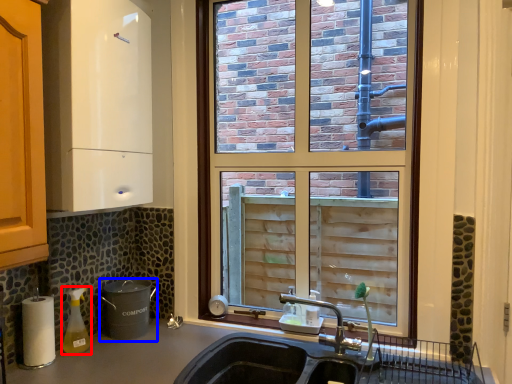
Question: Which of the following is the farthest to the observer, bottle (highlighted by a red box) or appliance (highlighted by a blue box)?

Choices:
 (A) bottle
 (B) appliance

Answer: (B)